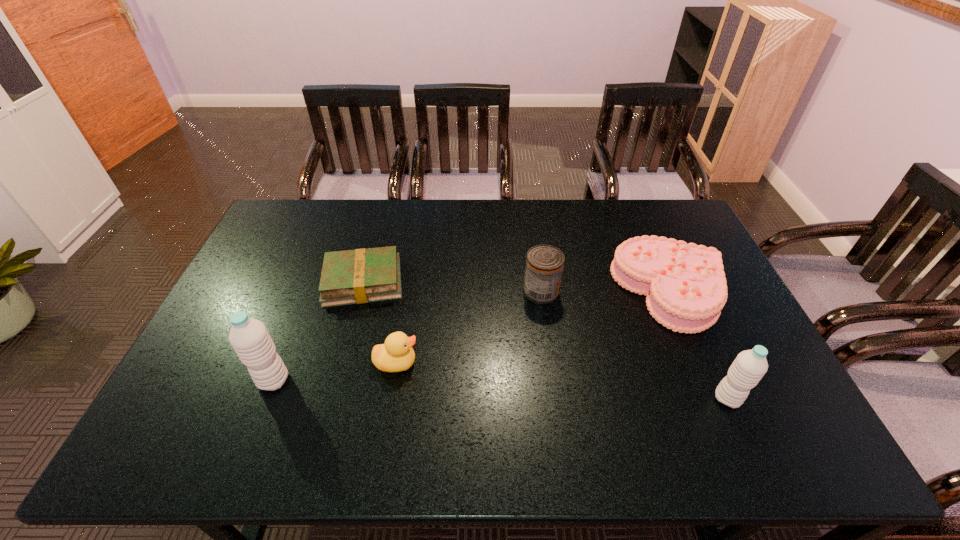
This screenshot has height=540, width=960. In order to click on empty space between the cake and the tallest object in this screenshot , I will do `click(471, 335)`.

Where is `free space between the cake and the shorter water bottle`? free space between the cake and the shorter water bottle is located at coordinates (699, 345).

Find the location of `empty space between the duckling and the third object from right to left`. empty space between the duckling and the third object from right to left is located at coordinates (468, 327).

Locate an element on the screen. object that is the fourth closest to the cake is located at coordinates (357, 276).

Select which object appears as the second closest to the duckling. Please provide its 2D coordinates. Your answer should be formatted as a tuple, i.e. [(x, y)], where the tuple contains the x and y coordinates of a point satisfying the conditions above.

[(249, 337)]

Locate an element on the screen. free space that satisfies the following two spatial constraints: 1. on the front side of the third object from right to left; 2. on the right side of the shortest object is located at coordinates (360, 291).

Where is `vacant region that satisfies the following two spatial constraints: 1. on the face of the duckling; 2. on the front side of the taller water bottle`? The width and height of the screenshot is (960, 540). vacant region that satisfies the following two spatial constraints: 1. on the face of the duckling; 2. on the front side of the taller water bottle is located at coordinates (394, 381).

Identify the location of vacant space that satisfies the following two spatial constraints: 1. on the face of the duckling; 2. on the back side of the shorter water bottle. The height and width of the screenshot is (540, 960). (391, 399).

Find the location of a particular element. vacant space that satisfies the following two spatial constraints: 1. on the front side of the shortest object; 2. on the left side of the second shortest object is located at coordinates (361, 291).

Where is `free spot that satisfies the following two spatial constraints: 1. on the face of the right water bottle; 2. on the left side of the duckling`? This screenshot has height=540, width=960. free spot that satisfies the following two spatial constraints: 1. on the face of the right water bottle; 2. on the left side of the duckling is located at coordinates (391, 399).